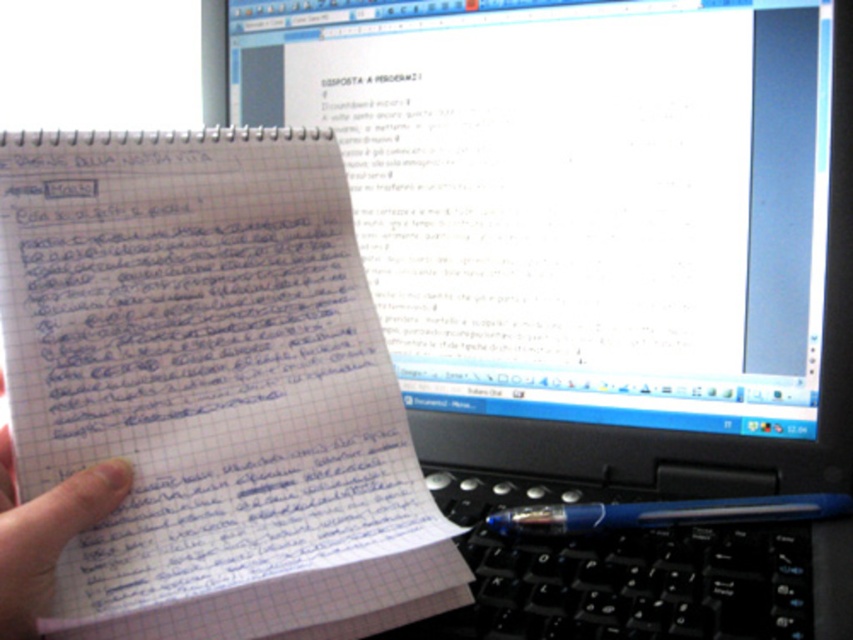
Question: Is white glossy monitor at upper center to the right of black plastic keyboard at lower center from the viewer's perspective?

Choices:
 (A) no
 (B) yes

Answer: (A)

Question: Among these objects, which one is nearest to the camera?

Choices:
 (A) white glossy monitor at upper center
 (B) black plastic keyboard at lower center
 (C) blue plastic pen at bottom right

Answer: (B)

Question: Does white lined paper at center appear over blue plastic pen at bottom right?

Choices:
 (A) yes
 (B) no

Answer: (A)

Question: Which object is the farthest from the blue paper at center?

Choices:
 (A) blue plastic pen at bottom right
 (B) white lined paper at center
 (C) white glossy monitor at upper center
 (D) black plastic keyboard at lower center

Answer: (C)

Question: Which object is farther from the camera taking this photo?

Choices:
 (A) white glossy monitor at upper center
 (B) black plastic keyboard at lower center
 (C) blue plastic pen at bottom right

Answer: (A)

Question: Does white glossy monitor at upper center appear over blue plastic pen at bottom right?

Choices:
 (A) yes
 (B) no

Answer: (A)